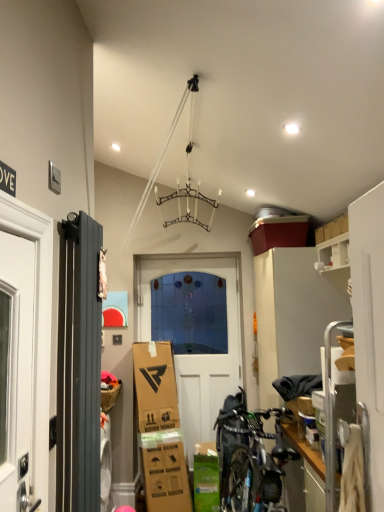
Question: Should I look upward or downward to see white matte door at center?

Choices:
 (A) up
 (B) down

Answer: (B)